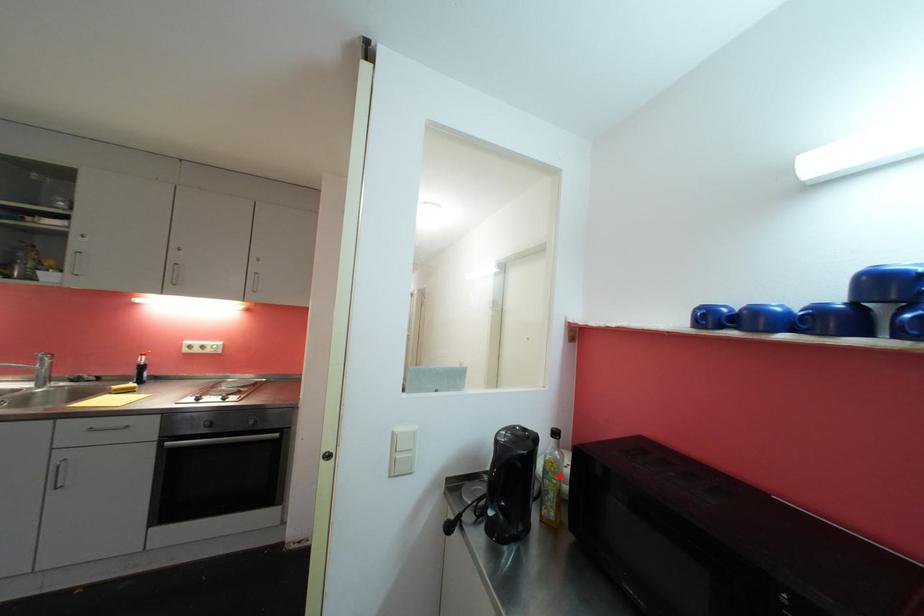
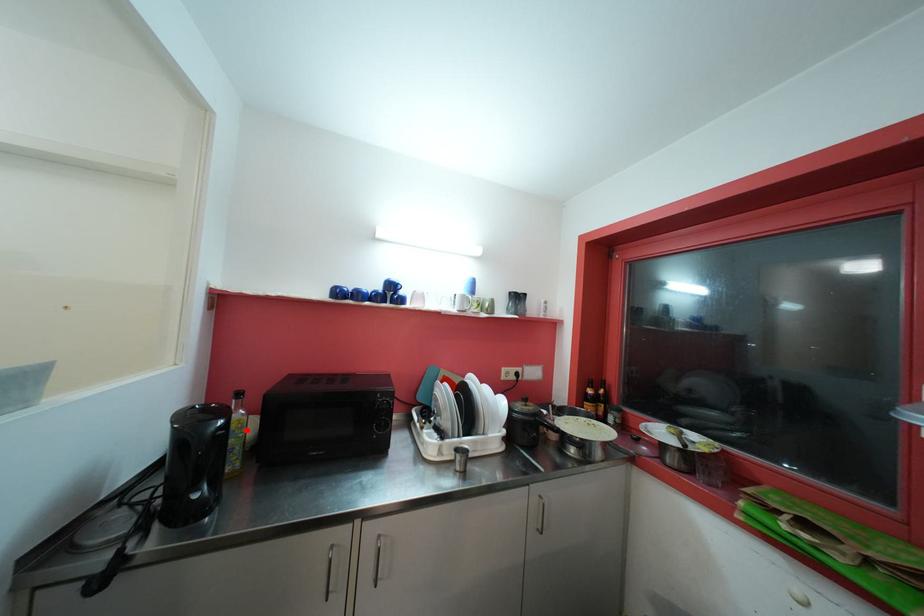
I am providing you with two images of the same scene from different viewpoints. A red point is marked on the first image and another point is marked on the second image. Is the marked point in image1 the same physical position as the marked point in image2?

Yes